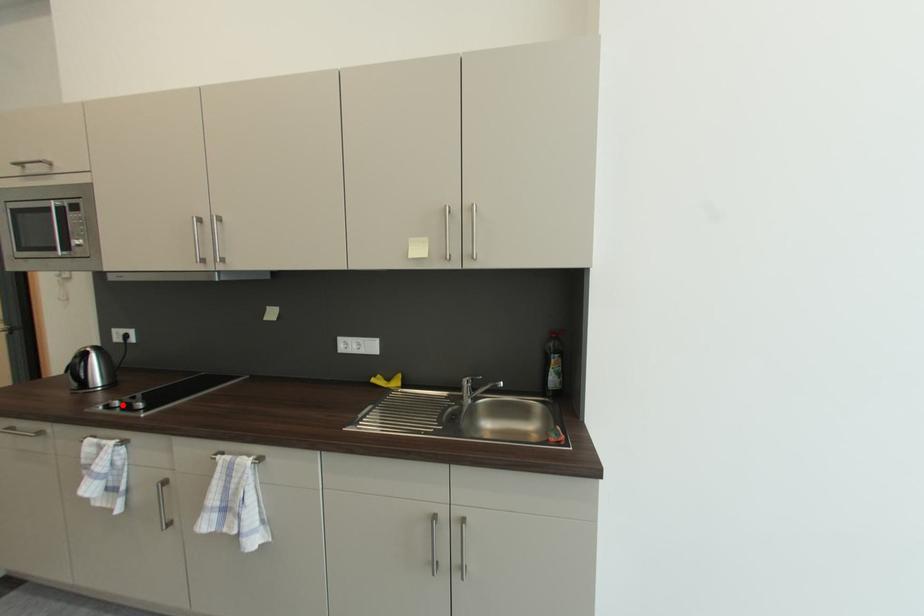
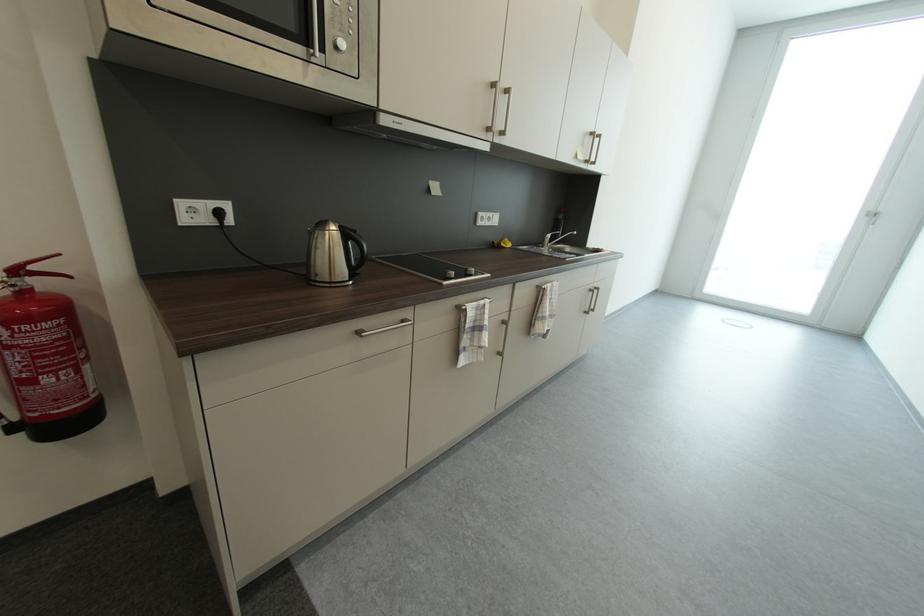
The point at the highlighted location is marked in the first image. Where is the corresponding point in the second image?

(458, 275)